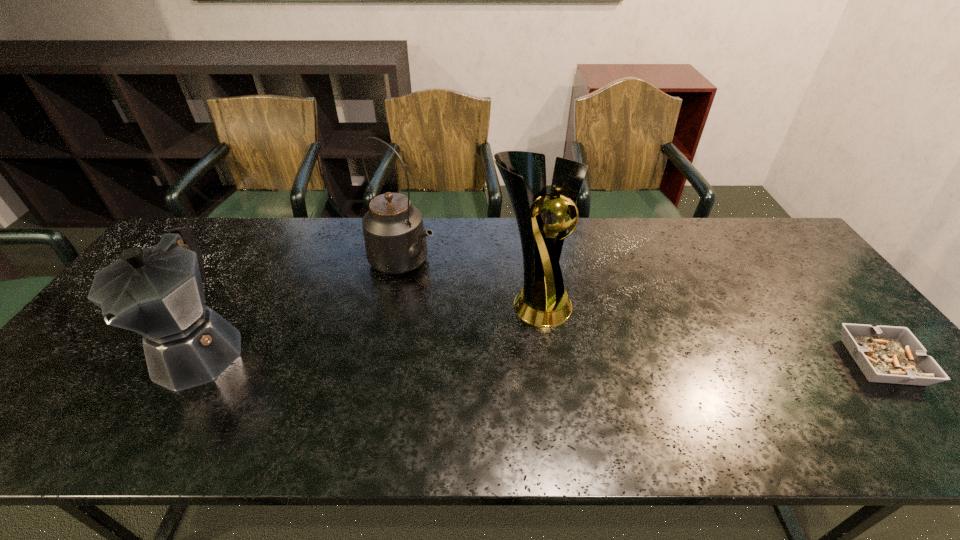
Locate an element on the screen. This screenshot has width=960, height=540. free point between the award and the coffeepot is located at coordinates (367, 326).

Where is `vacant region between the coffeepot and the kettle`? vacant region between the coffeepot and the kettle is located at coordinates (302, 306).

This screenshot has height=540, width=960. Identify the location of vacant area between the shortest object and the second tallest object. (642, 312).

Where is `free spot between the third object from left to right and the shortest object`? free spot between the third object from left to right and the shortest object is located at coordinates (707, 332).

Identify the location of empty space between the rightmost object and the third object from right to left. (642, 312).

Point out which object is positioned as the third nearest to the coffeepot. Please provide its 2D coordinates. Your answer should be formatted as a tuple, i.e. [(x, y)], where the tuple contains the x and y coordinates of a point satisfying the conditions above.

[(886, 354)]

The height and width of the screenshot is (540, 960). What are the coordinates of `object that is the closest to the kettle` in the screenshot? It's located at (543, 302).

Locate an element on the screen. This screenshot has height=540, width=960. vacant space that satisfies the following two spatial constraints: 1. on the front side of the third object from right to left; 2. on the left side of the rightmost object is located at coordinates click(x=384, y=362).

Identify the location of free space that satisfies the following two spatial constraints: 1. on the front side of the kettle; 2. on the right side of the ashtray. (384, 362).

Locate an element on the screen. free point that satisfies the following two spatial constraints: 1. on the front side of the third object from left to right; 2. on the right side of the ashtray is located at coordinates (540, 362).